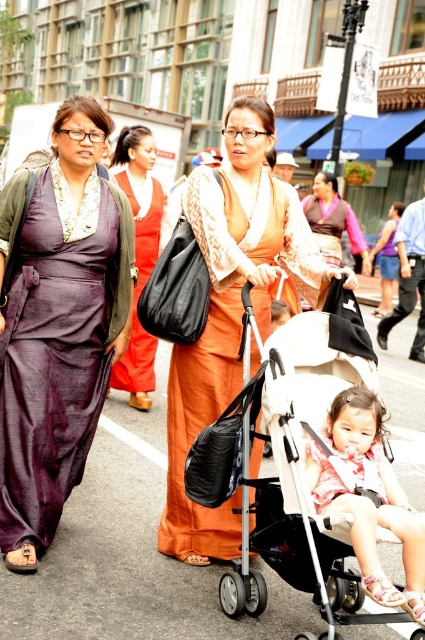
Does point (172, 547) come farther from viewer compared to point (317, 192)?

That is False.

Which is below, orange satin dress at center or matte orange dress at center?

orange satin dress at center is below.

Between point (235, 160) and point (354, 227), which one is positioned behind?

Positioned behind is point (354, 227).

At what (x,y) coordinates should I click in order to perform the action: click on orange satin dress at center. Please return your answer as a coordinate pair (x, y). The height and width of the screenshot is (640, 425). Looking at the image, I should click on (229, 310).

Based on the photo, which is more to the right, purple silk dress at left or orange satin dress at center?

From the viewer's perspective, orange satin dress at center appears more on the right side.

Is purple silk dress at left wider than orange satin dress at center?

No.

This screenshot has height=640, width=425. What do you see at coordinates (57, 355) in the screenshot?
I see `purple silk dress at left` at bounding box center [57, 355].

Identify the location of purple silk dress at left. (57, 355).

Image resolution: width=425 pixels, height=640 pixels. What do you see at coordinates (368, 499) in the screenshot? I see `matte pink dress at center` at bounding box center [368, 499].

This screenshot has height=640, width=425. What do you see at coordinates (368, 499) in the screenshot?
I see `matte pink dress at center` at bounding box center [368, 499].

Image resolution: width=425 pixels, height=640 pixels. Find the location of `matte pink dress at center`. matte pink dress at center is located at coordinates (368, 499).